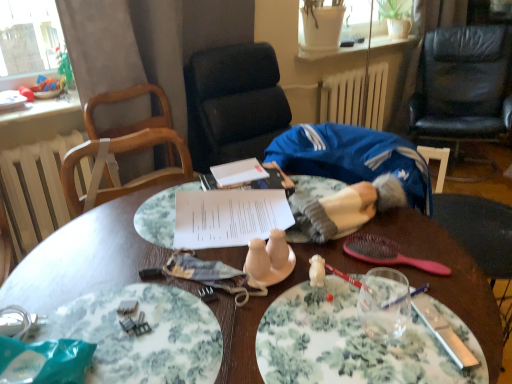
Find the location of `vacant space behind white ceramic salt and pepper shakers at center`. vacant space behind white ceramic salt and pepper shakers at center is located at coordinates (239, 240).